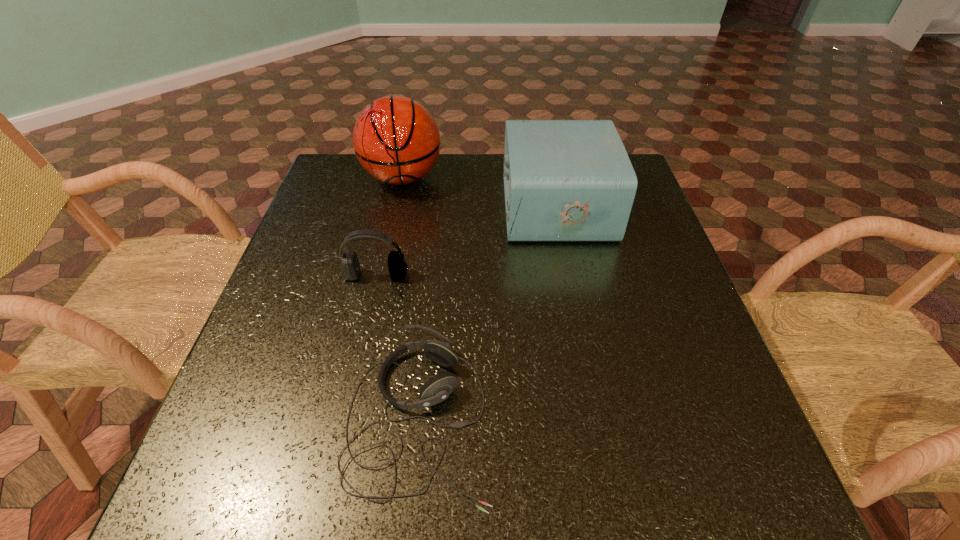
Where is `free space located on the front panel of the rightmost object`? Image resolution: width=960 pixels, height=540 pixels. free space located on the front panel of the rightmost object is located at coordinates (474, 207).

Where is `free location located 0.300m on the headband of the taller headset`? This screenshot has width=960, height=540. free location located 0.300m on the headband of the taller headset is located at coordinates (x=347, y=406).

Identify the location of free space located on the outer surface of the nearest object. (566, 418).

Locate an element on the screen. basketball that is at the far edge is located at coordinates (396, 139).

The height and width of the screenshot is (540, 960). Identify the location of radio receiver located in the far edge section of the desktop. (564, 180).

Locate an element on the screen. The width and height of the screenshot is (960, 540). object located at the near edge is located at coordinates (438, 388).

Identify the location of basketball present at the left edge. (396, 139).

At what (x,y) coordinates should I click in order to perform the action: click on headset positioned at the left edge. Please return your answer as a coordinate pair (x, y). The image size is (960, 540). Looking at the image, I should click on (350, 268).

At what (x,y) coordinates should I click in order to perform the action: click on object located in the right edge section of the desktop. Please return your answer as a coordinate pair (x, y). Looking at the image, I should click on (564, 180).

Identify the location of object situated at the far left corner. Image resolution: width=960 pixels, height=540 pixels. (396, 139).